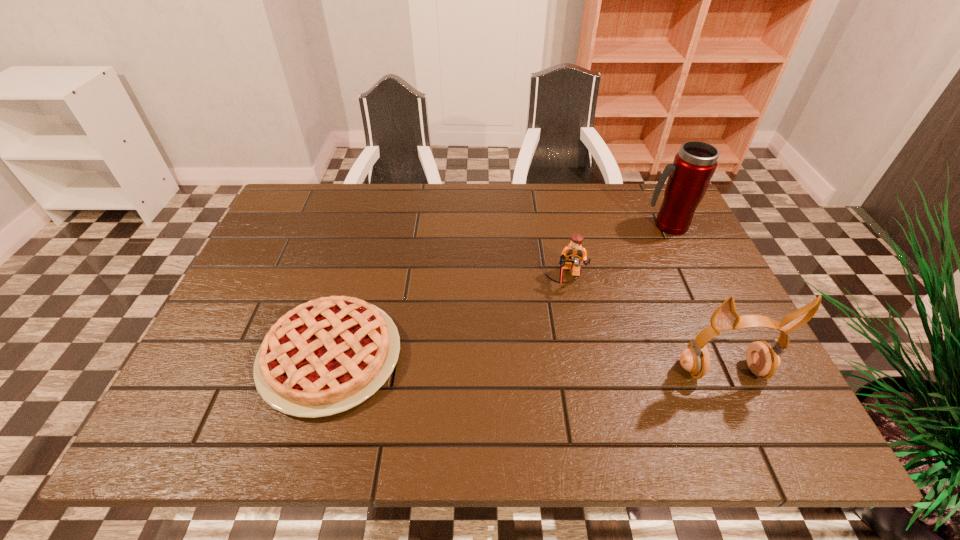
I want to click on object at the far right corner, so click(x=689, y=176).

Image resolution: width=960 pixels, height=540 pixels. What are the coordinates of `object that is at the near right corner` in the screenshot? It's located at (762, 359).

Identify the location of vacant space at the far edge of the desktop. 445,201.

Image resolution: width=960 pixels, height=540 pixels. I want to click on free space at the near edge of the desktop, so click(604, 363).

At what (x,y) coordinates should I click in order to perform the action: click on free space at the left edge. Please return your answer as a coordinate pair (x, y). Looking at the image, I should click on (273, 254).

Where is `vacant space at the right edge`? The image size is (960, 540). vacant space at the right edge is located at coordinates (668, 287).

The width and height of the screenshot is (960, 540). In the image, there is a desktop. Identify the location of vacant space at the far left corner. (317, 191).

At what (x,y) coordinates should I click in order to perform the action: click on free region at the near left corner of the desktop. Please return your answer as a coordinate pair (x, y). Looking at the image, I should click on (216, 384).

This screenshot has width=960, height=540. In order to click on vacant area that lies between the Lego and the earphone in this screenshot , I will do `click(644, 324)`.

Identify the location of free space between the thermos bottle and the earphone. Image resolution: width=960 pixels, height=540 pixels. (694, 298).